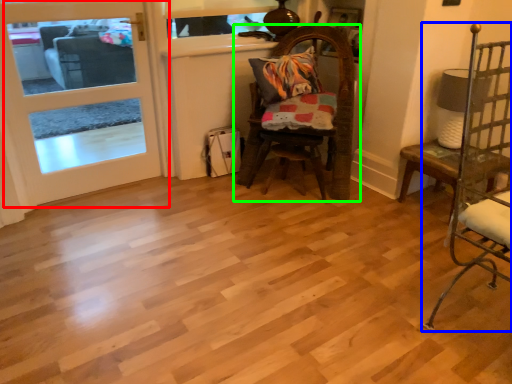
Question: Which object is the farthest from door (highlighted by a red box)? Choose among these: chair (highlighted by a blue box) or chair (highlighted by a green box).

Choices:
 (A) chair
 (B) chair

Answer: (A)